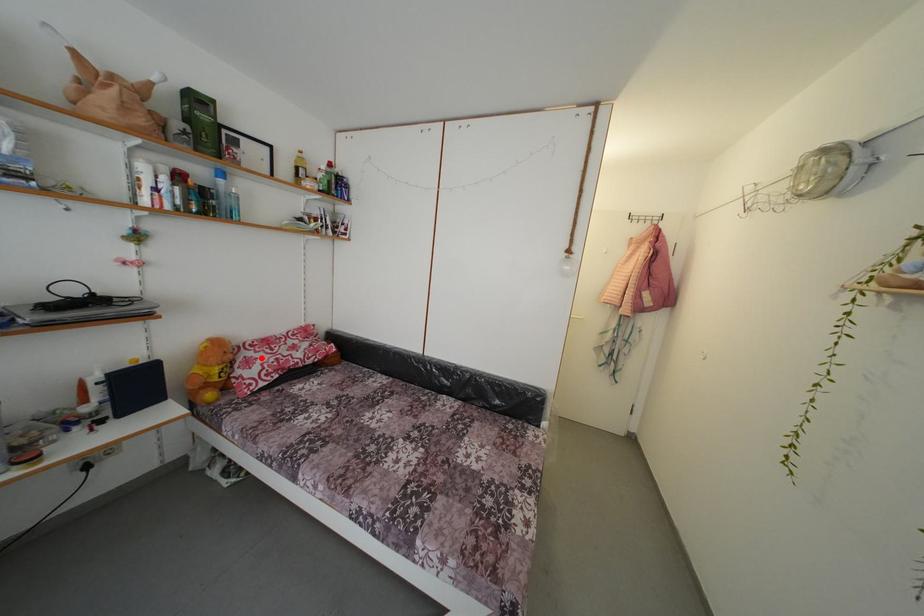
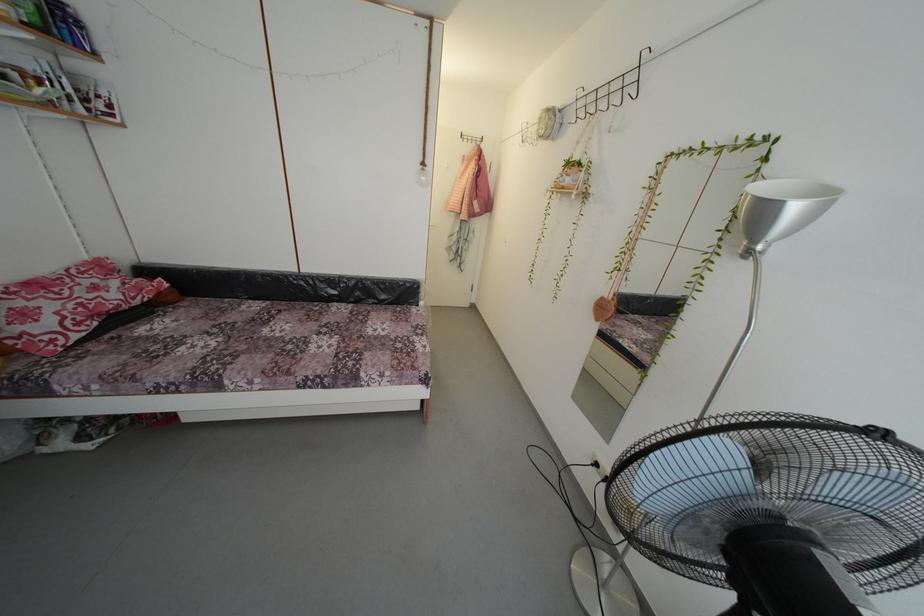
Find the pixel in the second image that matches the highlighted location in the first image.

(34, 306)